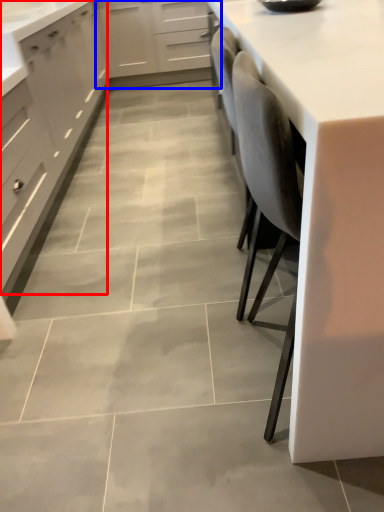
Question: Which object is closer to the camera taking this photo, cabinetry (highlighted by a red box) or cabinetry (highlighted by a blue box)?

Choices:
 (A) cabinetry
 (B) cabinetry

Answer: (A)